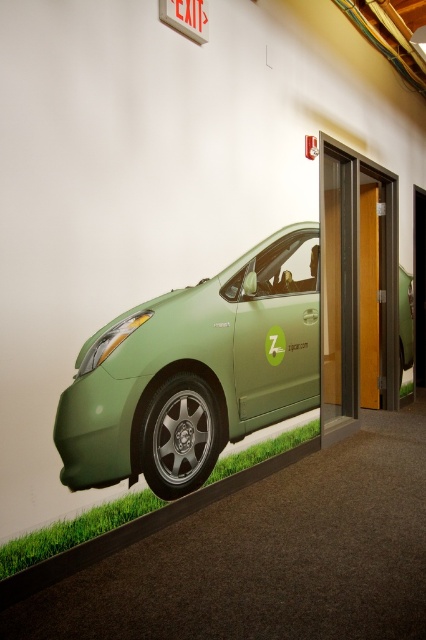
Question: Is green matte car at lower left bigger than wooden elevator door at center?

Choices:
 (A) no
 (B) yes

Answer: (B)

Question: Which point is closer to the camera taking this photo?

Choices:
 (A) (163, 432)
 (B) (359, 372)

Answer: (A)

Question: Which of the following is the closest to the observer?

Choices:
 (A) (88, 435)
 (B) (354, 172)

Answer: (A)

Question: Can you confirm if green matte car at lower left is thinner than wooden elevator door at center?

Choices:
 (A) yes
 (B) no

Answer: (B)

Question: Is green matte car at lower left smaller than wooden elevator door at center?

Choices:
 (A) no
 (B) yes

Answer: (A)